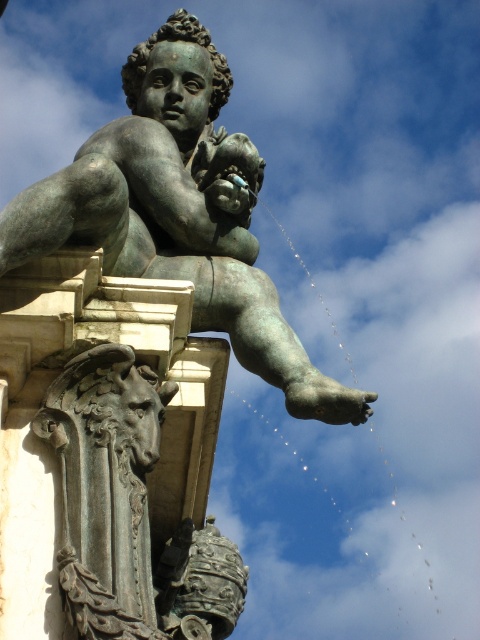
Consider the image. You are an art conservator tasked with moving the green patina bronze statue at center and the dark gray stone horse head at lower left into a storage room. The storage room has a 12 meter wide door. Can both objects fit through the door at the same time?

The distance between the green patina bronze statue at center and dark gray stone horse head at lower left is 13.00 meters. Since the door is only 12 meters wide, the two objects cannot fit through the door simultaneously as their combined width exceeds the door width.

You are standing in front of the bronze statue of the cherub. There are two points marked on the statue. One is at coordinate point (196, 100) and the other is at point (82, 609). Which of these two points is closer to you?

Point (196, 100) is closer to you because it is further to the viewer than point (82, 609).

You are an art curator planning to display both the green patina bronze statue at center and the dark gray stone horse head at lower left in a new exhibition. Based on their sizes, which object should be placed in a more prominent position to highlight its scale?

The green patina bronze statue at center should be placed in a more prominent position because it has a larger size compared to the dark gray stone horse head at lower left.